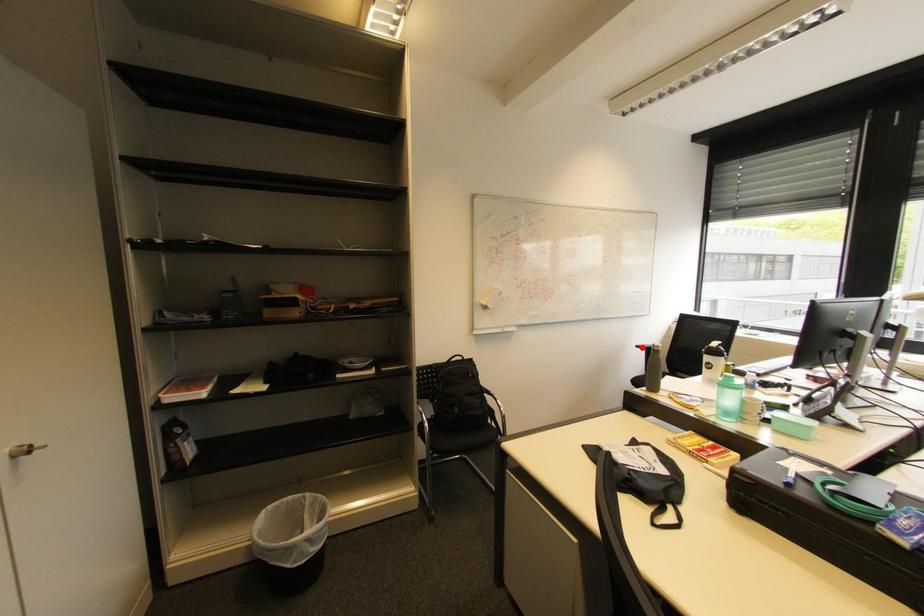
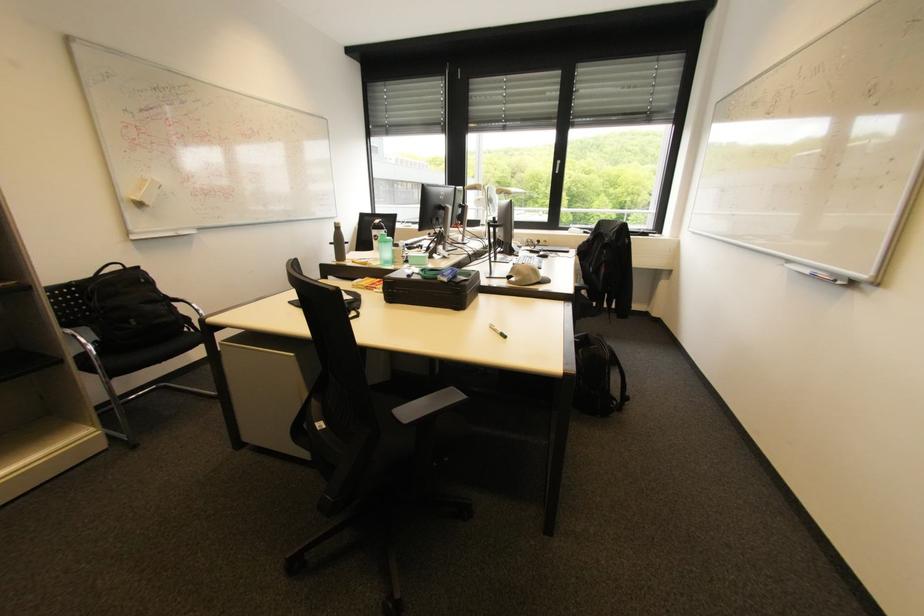
Where in the second image is the point corresponding to the highlighted location from the first image?

(335, 244)